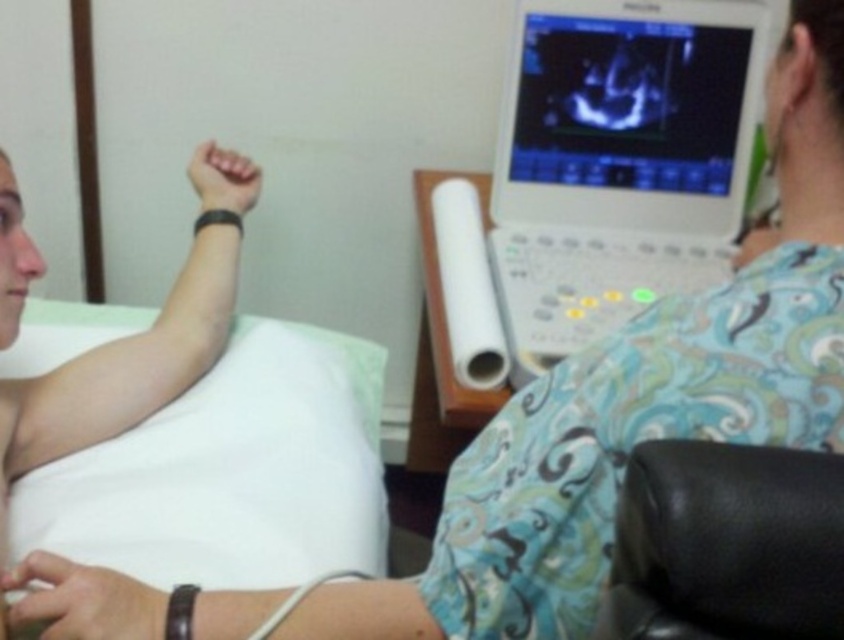
You are a patient entering the room and need to sit down. There is a white fabric bed at upper left and a black leather armchair at lower right. Which one is taller?

The white fabric bed at upper left is taller than the black leather armchair at lower right according to the description.

You are a patient in the medical room and need to look at the ultrasound results displayed on the matte plastic monitor at upper right while sitting on the black leather armchair at lower right. Can you comfortably view the monitor without needing to adjust your seating position?

The matte plastic monitor at upper right is located above the black leather armchair at lower right, so you can comfortably view the monitor without needing to adjust your seating position as it is positioned at a suitable height.

You are a medical technician who needs to adjust the angle of the ultrasound monitor to get a better view. Considering the positions of the white fabric bed at upper left and the matte plastic monitor at upper right, which object is taller and would require you to look up or down when adjusting the monitor?

The white fabric bed at upper left is taller than the matte plastic monitor at upper right. To adjust the monitor, you would need to look down since the bed is higher.